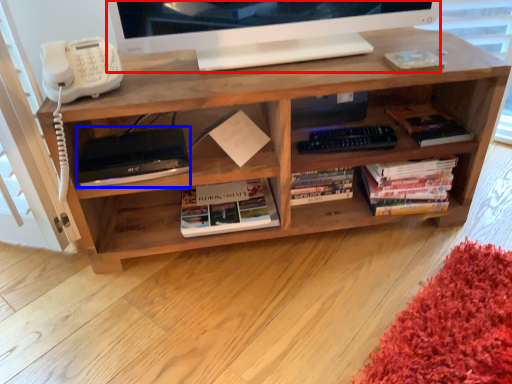
Question: Which object appears farthest to the camera in this image, television (highlighted by a red box) or equipment (highlighted by a blue box)?

Choices:
 (A) television
 (B) equipment

Answer: (B)